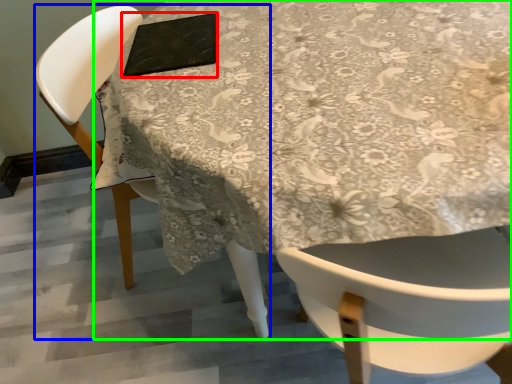
Question: Based on their relative distances, which object is farther from pad (highlighted by a red box)? Choose from chair (highlighted by a blue box) and table (highlighted by a green box).

Choices:
 (A) chair
 (B) table

Answer: (A)